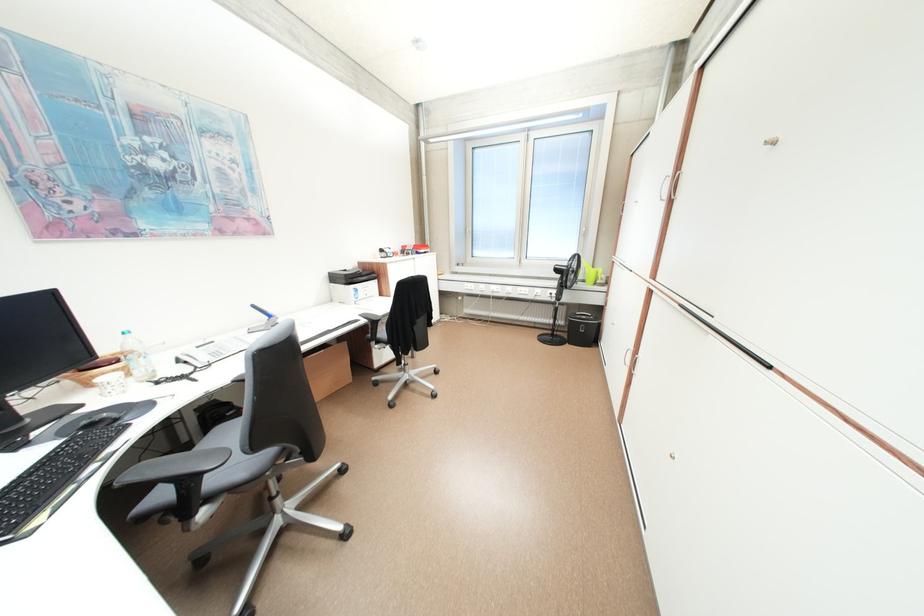
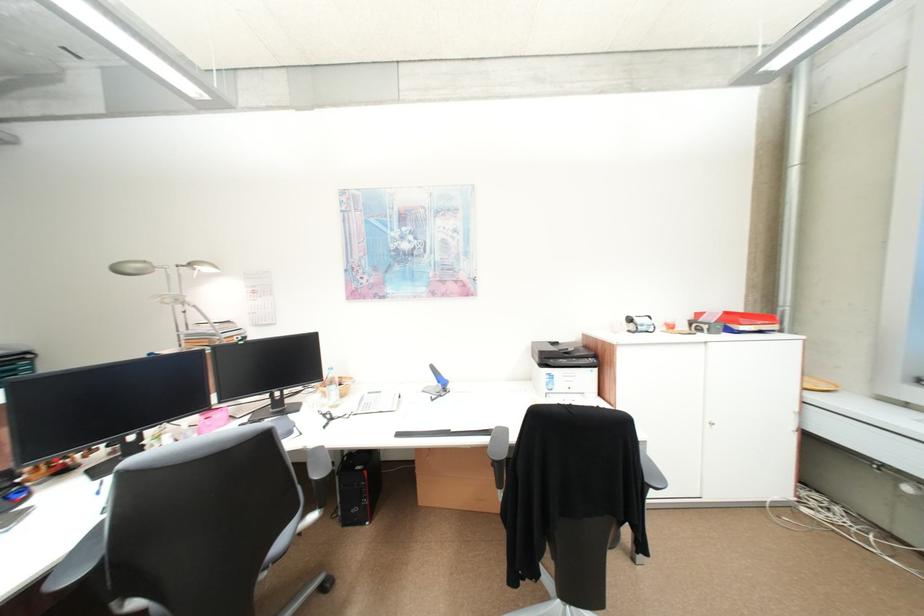
In the second image, find the point that corresponds to the point at 432,252 in the first image.

(754, 329)